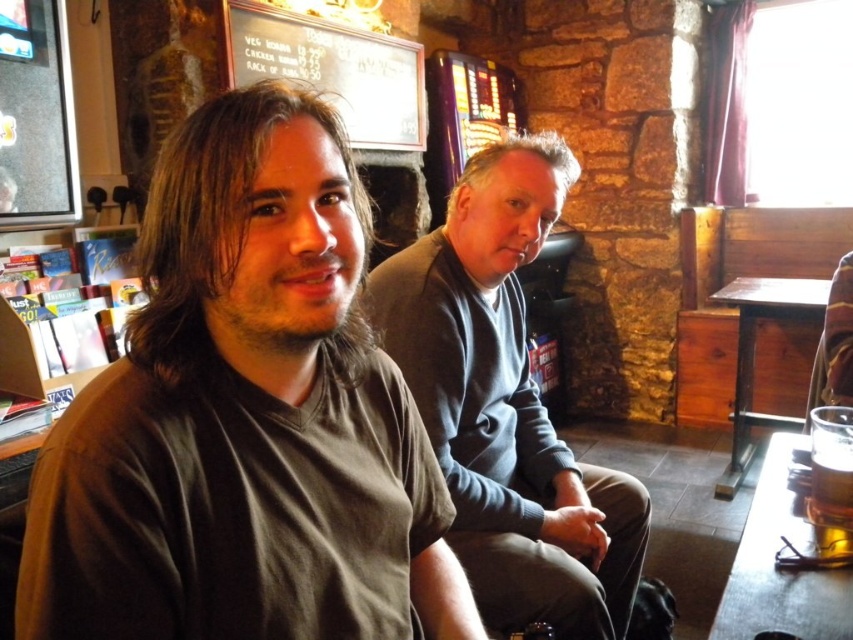
What are the coordinates of `brown matte shirt at left` in the screenshot? It's located at (245, 419).

Is point (328, 465) behind point (850, 520)?

No, (328, 465) is in front of (850, 520).

Does point (213, 240) lie behind point (831, 492)?

No, it is not.

Identify the location of brown matte shirt at left. (245, 419).

Between point (293, 102) and point (822, 308), which one is positioned in front?

Point (293, 102) is more forward.

Based on the photo, who is taller, brown matte shirt at left or wooden table at right?

Standing taller between the two is wooden table at right.

What do you see at coordinates (245, 419) in the screenshot? The width and height of the screenshot is (853, 640). I see `brown matte shirt at left` at bounding box center [245, 419].

Identify the location of brown matte shirt at left. The height and width of the screenshot is (640, 853). (245, 419).

Can you confirm if brown matte shirt at left is wider than wooden table at lower right?

No, brown matte shirt at left is not wider than wooden table at lower right.

Does brown matte shirt at left come behind wooden table at lower right?

No, it is not.

Identify the location of brown matte shirt at left. Image resolution: width=853 pixels, height=640 pixels. (245, 419).

I want to click on brown matte shirt at left, so click(x=245, y=419).